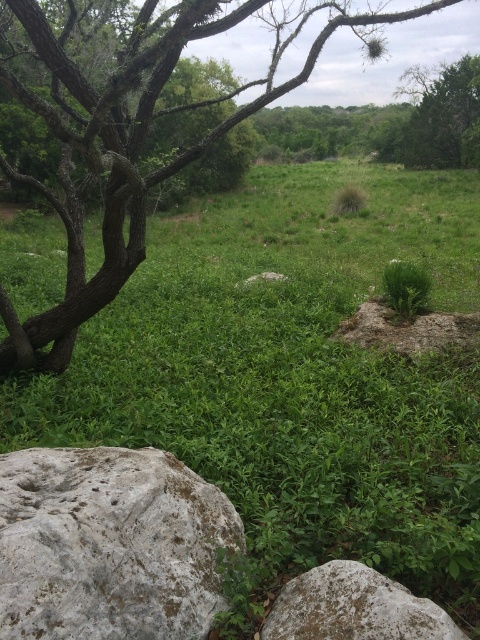
Between gray rough rock at lower left and gray rough rock at lower right, which one has more height?

With more height is gray rough rock at lower left.

Can you confirm if gray rough rock at lower left is wider than gray rough rock at lower right?

Yes.

Which is behind, point (129, 612) or point (284, 627)?

The point (284, 627) is more distant.

Find the location of a particular element. gray rough rock at lower left is located at coordinates (109, 545).

Does green leafy tree at left have a lesser width compared to gray rough rock at lower right?

Incorrect, green leafy tree at left's width is not less than gray rough rock at lower right's.

Who is more forward, (112,84) or (337,582)?

Point (337,582) is in front.

The width and height of the screenshot is (480, 640). What are the coordinates of `green leafy tree at left` in the screenshot? It's located at (129, 145).

In order to click on gray rough rock at lower left in this screenshot , I will do pyautogui.click(x=109, y=545).

Is point (31, 616) behind point (37, 109)?

That is False.

Image resolution: width=480 pixels, height=640 pixels. Describe the element at coordinates (109, 545) in the screenshot. I see `gray rough rock at lower left` at that location.

Identify the location of gray rough rock at lower left. (109, 545).